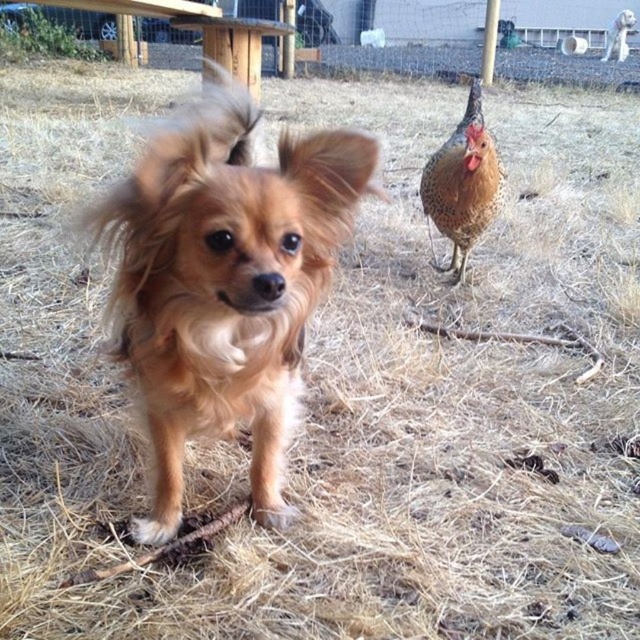
Is brown fluffy dog at center wider than brown speckled feathers at upper right?

Yes, brown fluffy dog at center is wider than brown speckled feathers at upper right.

Is the position of brown fluffy dog at center less distant than that of brown speckled feathers at upper right?

Yes, brown fluffy dog at center is closer to the viewer.

Which is behind, point (182, 417) or point (476, 113)?

Positioned behind is point (476, 113).

Image resolution: width=640 pixels, height=640 pixels. In order to click on brown fluffy dog at center in this screenshot , I will do `click(224, 282)`.